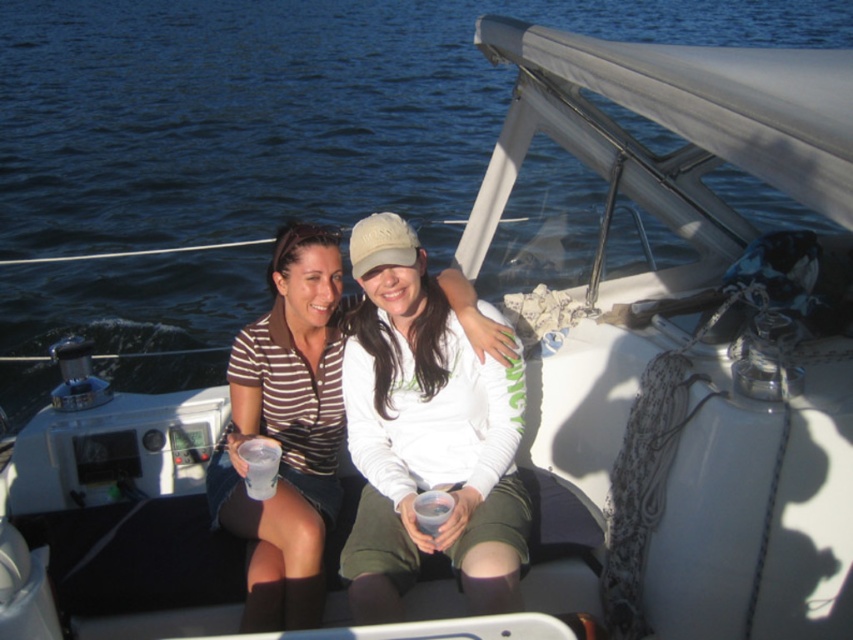
Question: Based on their relative distances, which object is nearer to the clear plastic cup at center?

Choices:
 (A) translucent plastic cup at center
 (B) matte striped shirt at center
 (C) striped jersey at center

Answer: (C)

Question: Does striped fabric shirt at center have a smaller size compared to matte striped shirt at center?

Choices:
 (A) yes
 (B) no

Answer: (B)

Question: Which of the following is the farthest from the observer?

Choices:
 (A) (271, 493)
 (B) (238, 362)

Answer: (B)

Question: Is clear plastic cup at center thinner than translucent plastic cup at center?

Choices:
 (A) yes
 (B) no

Answer: (B)

Question: Which object is positioned farthest from the clear plastic cup at center?

Choices:
 (A) striped fabric shirt at center
 (B) matte striped shirt at center
 (C) striped jersey at center

Answer: (B)

Question: Is striped jersey at center closer to camera compared to translucent plastic cup at center?

Choices:
 (A) yes
 (B) no

Answer: (B)